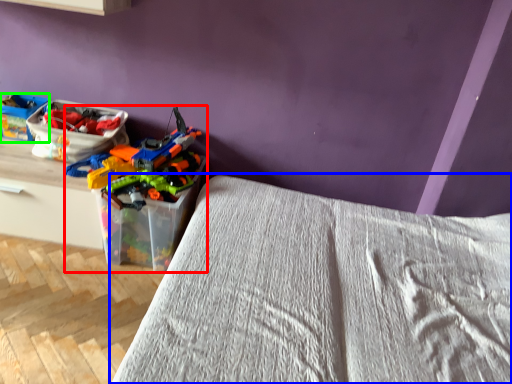
Question: Based on their relative distances, which object is nearer to toy (highlighted by a red box)? Choose from bed (highlighted by a blue box) and kit (highlighted by a green box).

Choices:
 (A) bed
 (B) kit

Answer: (B)